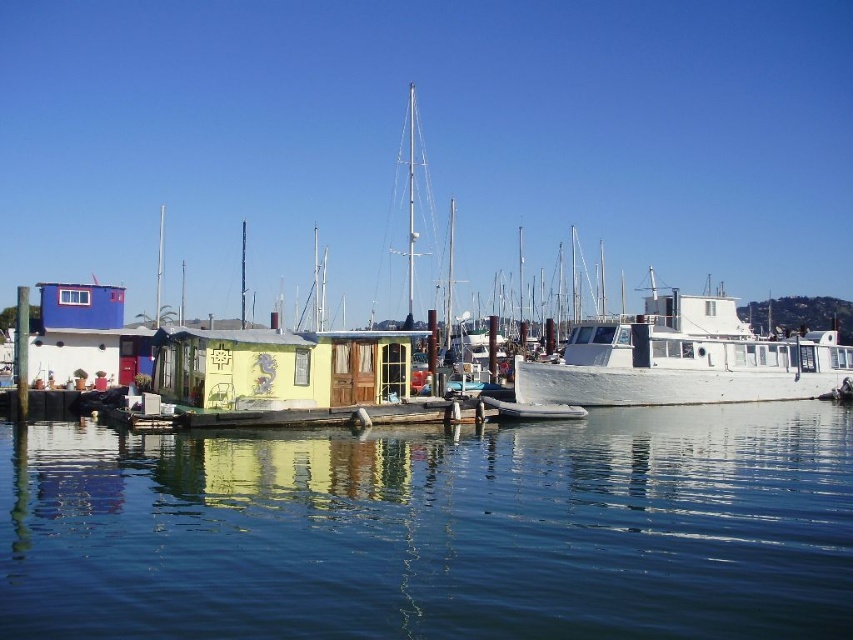
Looking at this image, between transparent blue water at center and white matte boat at center, which one appears on the left side from the viewer's perspective?

transparent blue water at center

Can you confirm if transparent blue water at center is positioned to the left of white matte boat at center?

Yes, transparent blue water at center is to the left of white matte boat at center.

Find the location of a particular element. This screenshot has height=640, width=853. transparent blue water at center is located at coordinates (436, 529).

Find the location of a particular element. The image size is (853, 640). transparent blue water at center is located at coordinates (436, 529).